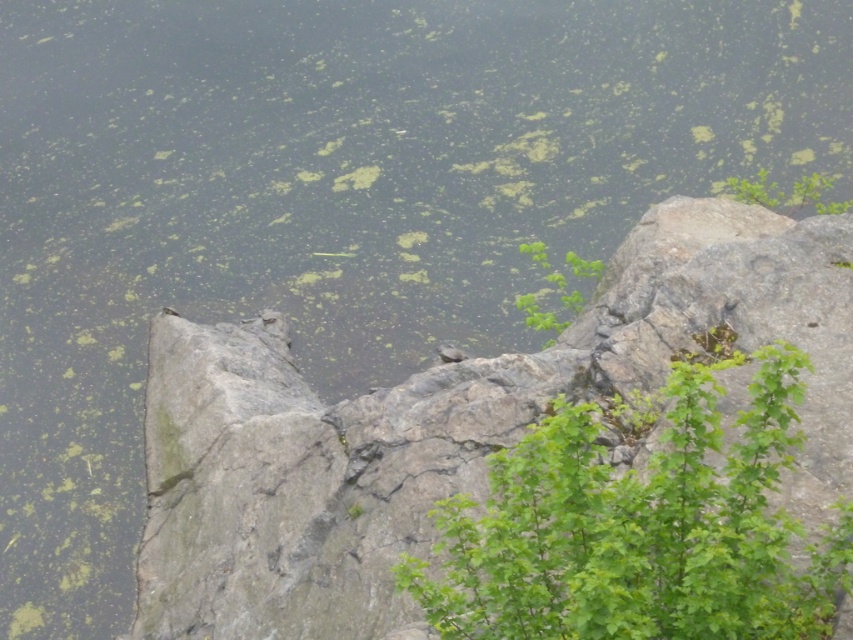
You are a botanist studying the green leafy plant at center and the green leafy plant at upper right in the image. Which plant would you prioritize for closer examination if you want to observe the species that is more common in this environment?

The green leafy plant at center is larger in size than the green leafy plant at upper right, so it might be more common in this environment and should be prioritized for closer examination.